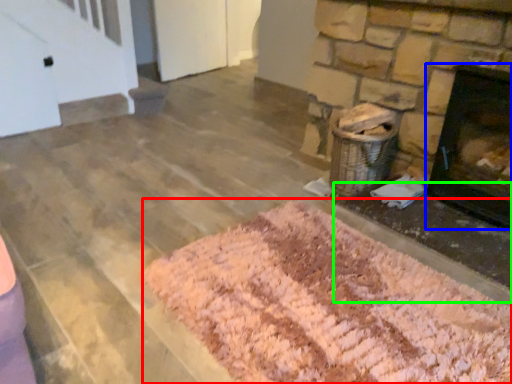
Question: Based on their relative distances, which object is nearer to mat (highlighted by a red box)? Choose from fireplace (highlighted by a blue box) and foundation (highlighted by a green box).

Choices:
 (A) fireplace
 (B) foundation

Answer: (B)